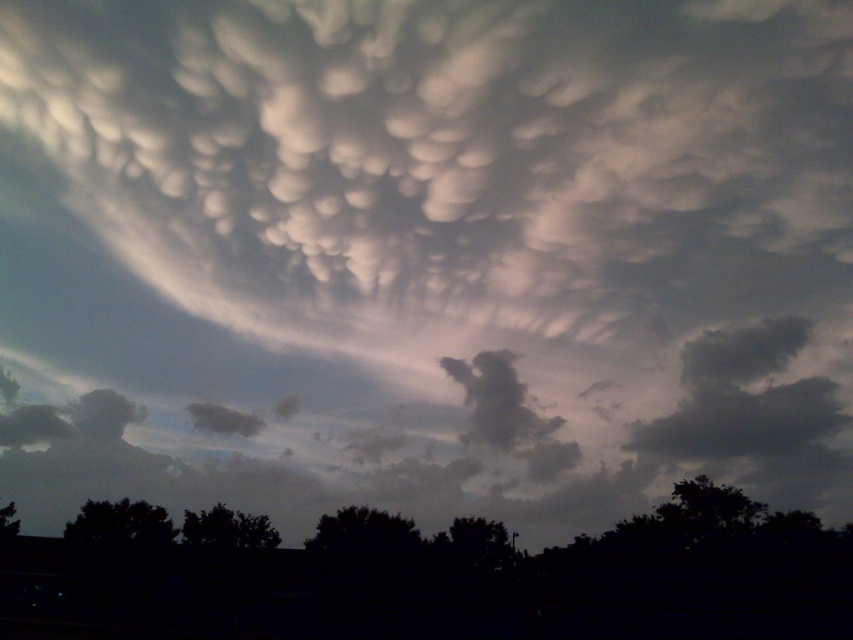
Is point (389, 552) behind point (7, 512)?

No, (389, 552) is in front of (7, 512).

Between dark green leafy tree at center and green leafy tree at lower left, which one appears on the left side from the viewer's perspective?

Positioned to the left is green leafy tree at lower left.

Which is in front, point (393, 528) or point (6, 531)?

Positioned in front is point (393, 528).

Locate an element on the screen. The height and width of the screenshot is (640, 853). dark green leafy tree at center is located at coordinates (363, 532).

Does dark green leafy tree at lower right lie behind green leafy tree at lower center?

No, dark green leafy tree at lower right is closer to the viewer.

Is dark green leafy tree at lower right bigger than green leafy tree at lower center?

Correct, dark green leafy tree at lower right is larger in size than green leafy tree at lower center.

Find the location of a particular element. This screenshot has height=640, width=853. dark green leafy tree at lower right is located at coordinates (706, 508).

Between point (119, 541) and point (12, 506), which one is positioned behind?

Positioned behind is point (12, 506).

Is point (99, 525) positioned behind point (0, 520)?

No, it is in front of (0, 520).

Identify the location of dark green leafy tree at lower left. The image size is (853, 640). (120, 524).